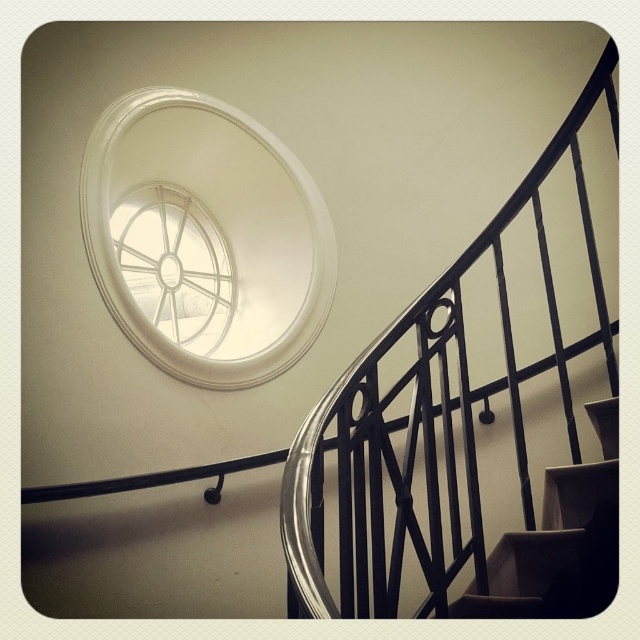
Between black metal railing at upper right and white glass spiral at upper center, which one appears on the right side from the viewer's perspective?

From the viewer's perspective, black metal railing at upper right appears more on the right side.

Where is `black metal railing at upper right`? The width and height of the screenshot is (640, 640). black metal railing at upper right is located at coordinates (429, 419).

Is point (593, 257) positioned before point (122, 212)?

Yes, point (593, 257) is in front of point (122, 212).

This screenshot has height=640, width=640. Identify the location of black metal railing at upper right. (429, 419).

In the scene shown: Is smooth beige stairs at lower right closer to the viewer compared to white glass spiral at upper center?

That is True.

Identify the location of smooth beige stairs at lower right. (561, 541).

Identify the location of smooth beige stairs at lower right. Image resolution: width=640 pixels, height=640 pixels. (561, 541).

Can you confirm if black metal railing at upper right is positioned below smooth beige stairs at lower right?

Incorrect, black metal railing at upper right is not positioned below smooth beige stairs at lower right.

Locate an element on the screen. Image resolution: width=640 pixels, height=640 pixels. black metal railing at upper right is located at coordinates (429, 419).